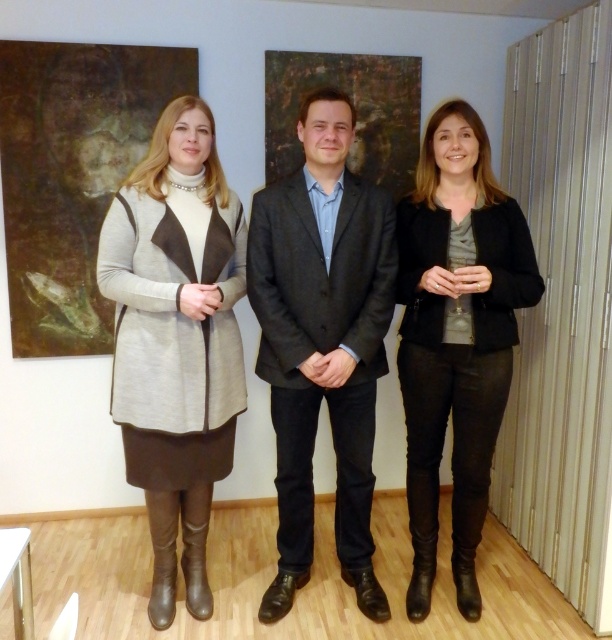
Question: Which of the following is the farthest from the observer?

Choices:
 (A) black leather pants at center
 (B) matte gray coat at center
 (C) dark gray suit at center

Answer: (C)

Question: Which point is farther to the camera?

Choices:
 (A) matte gray coat at center
 (B) dark gray suit at center

Answer: (B)

Question: Is dark gray suit at center positioned at the back of black leather pants at center?

Choices:
 (A) yes
 (B) no

Answer: (A)

Question: Is matte gray coat at center bigger than black leather pants at center?

Choices:
 (A) no
 (B) yes

Answer: (A)

Question: Does dark gray suit at center have a larger size compared to black leather pants at center?

Choices:
 (A) yes
 (B) no

Answer: (B)

Question: Which of the following is the closest to the observer?

Choices:
 (A) dark gray suit at center
 (B) matte gray coat at center
 (C) black leather pants at center

Answer: (B)